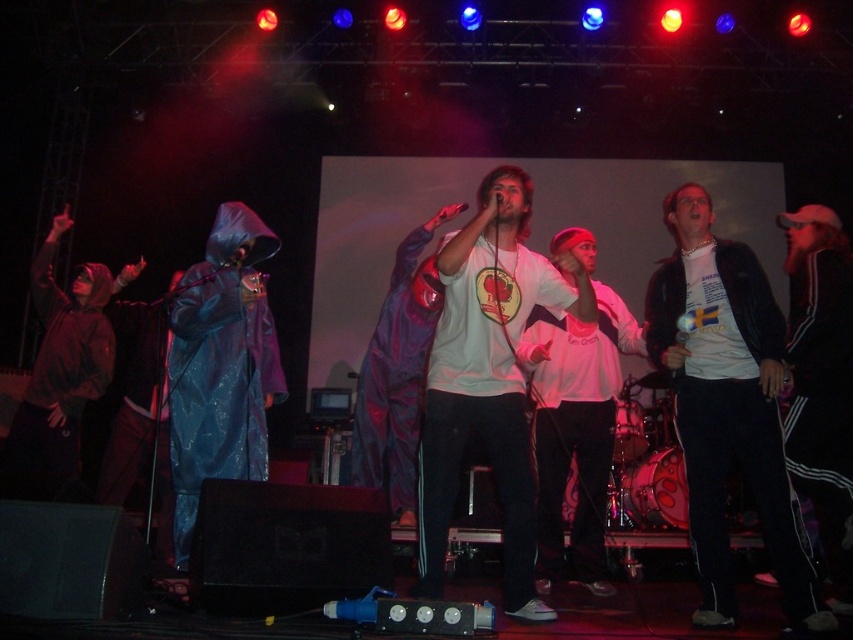
Question: Can you confirm if white matte t-shirt at center is positioned below white matte hoodie at center?

Choices:
 (A) no
 (B) yes

Answer: (A)

Question: Does blue shiny raincoat at left appear on the right side of black adidas tracksuit at right?

Choices:
 (A) yes
 (B) no

Answer: (B)

Question: Which of these objects is positioned closest to the shiny purple raincoat at center?

Choices:
 (A) black adidas tracksuit at right
 (B) matte blue raincoat at left

Answer: (B)

Question: Which object is the closest to the shiny purple raincoat at center?

Choices:
 (A) black leather jacket at center
 (B) matte blue raincoat at left

Answer: (B)

Question: Can you confirm if white matte hoodie at center is positioned above shiny purple raincoat at center?

Choices:
 (A) no
 (B) yes

Answer: (A)

Question: Which point is closer to the camera taking this photo?

Choices:
 (A) (776, 500)
 (B) (573, 460)
 (C) (25, 493)

Answer: (C)